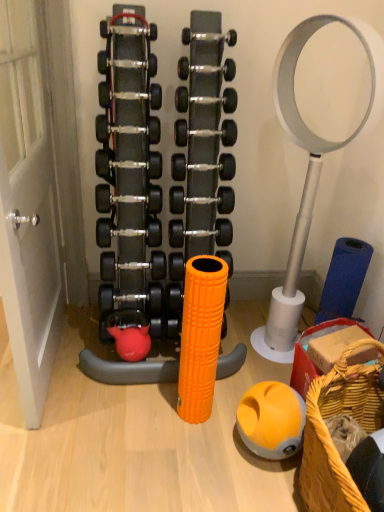
This screenshot has width=384, height=512. I want to click on vacant region to the left of orange rubber ball at lower center, so click(x=215, y=448).